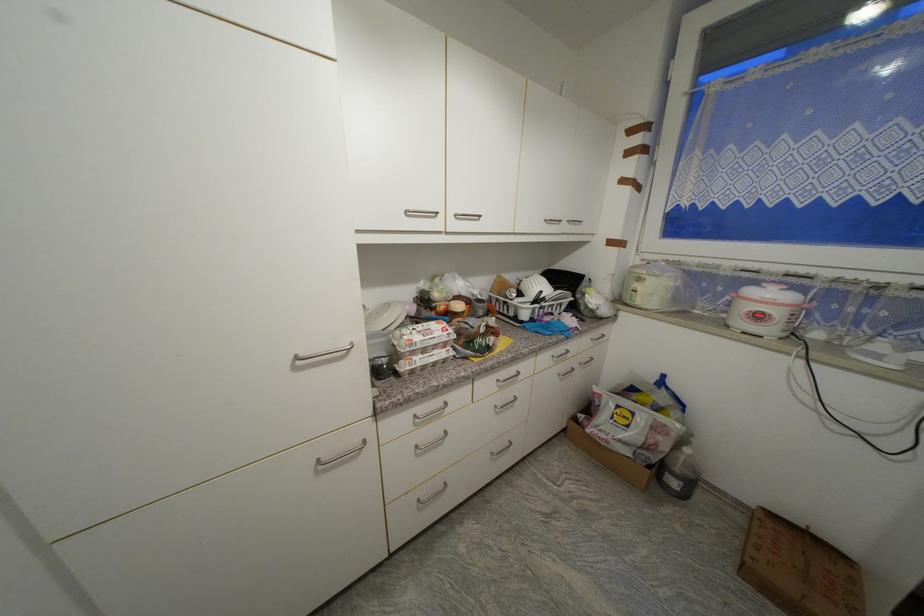
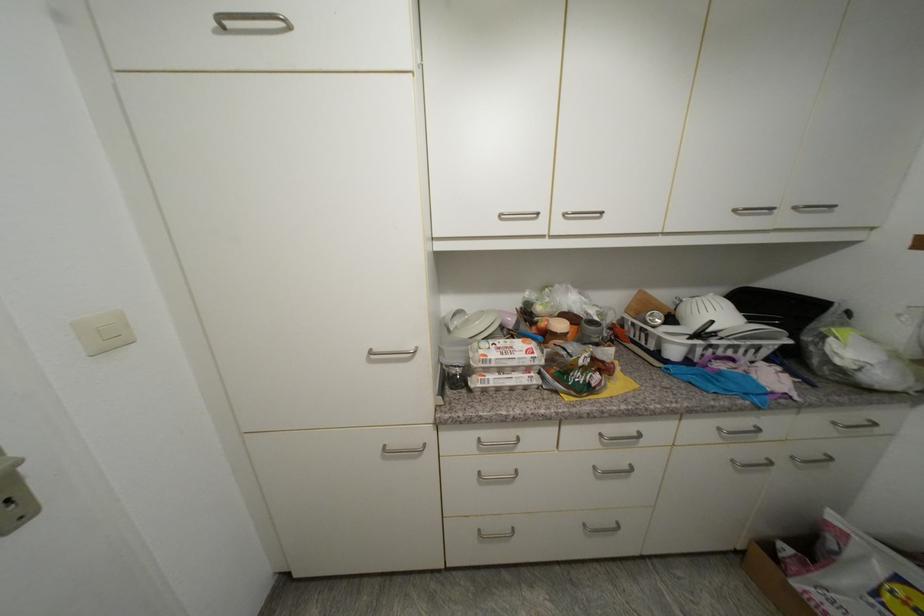
Question: The first image is from the beginning of the video and the second image is from the end. How did the camera likely rotate when shooting the video?

Choices:
 (A) Left
 (B) Right
 (C) Up
 (D) Down

Answer: (A)